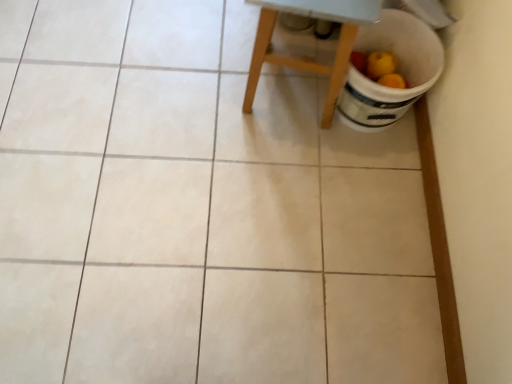
Identify the location of vacant region to the left of wooden stool at lower right. (188, 89).